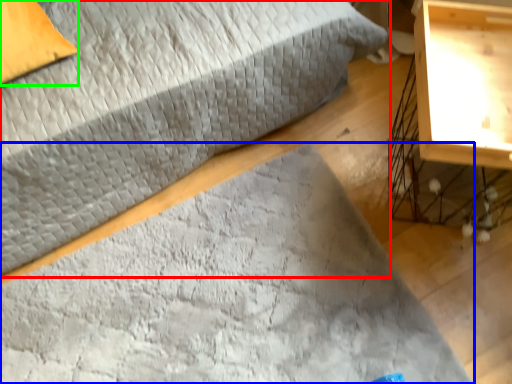
Question: Which object is positioned farthest from bed (highlighted by a red box)? Select from mat (highlighted by a blue box) and pillow (highlighted by a green box).

Choices:
 (A) mat
 (B) pillow

Answer: (A)